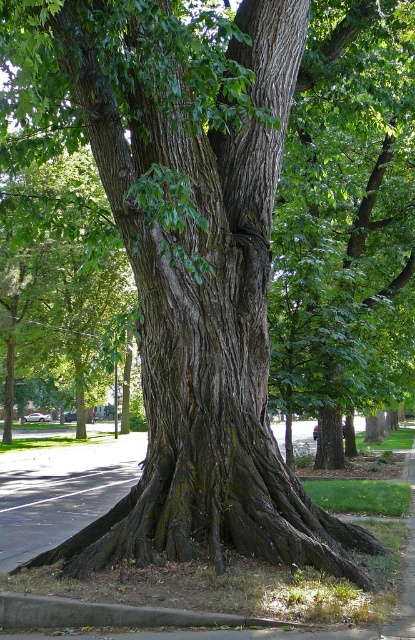
Question: Which object is farther from the camera taking this photo?

Choices:
 (A) gray asphalt at lower left
 (B) gray concrete curb at lower center

Answer: (B)

Question: Is gray asphalt at lower left positioned before gray concrete curb at lower center?

Choices:
 (A) no
 (B) yes

Answer: (B)

Question: Is gray asphalt at lower left to the right of gray concrete curb at lower center from the viewer's perspective?

Choices:
 (A) yes
 (B) no

Answer: (A)

Question: Is gray asphalt at lower left below gray concrete curb at lower center?

Choices:
 (A) no
 (B) yes

Answer: (B)

Question: Which point is closer to the camera taking this photo?

Choices:
 (A) (144, 625)
 (B) (161, 582)

Answer: (A)